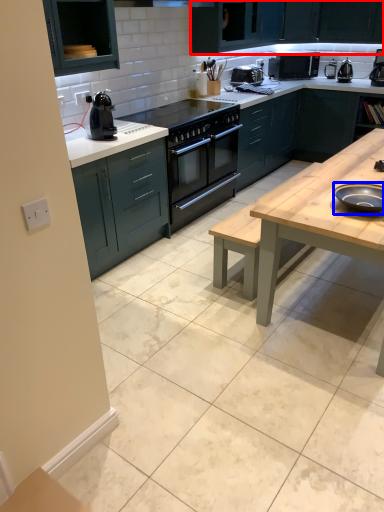
Question: Which object appears closest to the camera in this image, cabinetry (highlighted by a red box) or appliance (highlighted by a blue box)?

Choices:
 (A) cabinetry
 (B) appliance

Answer: (B)